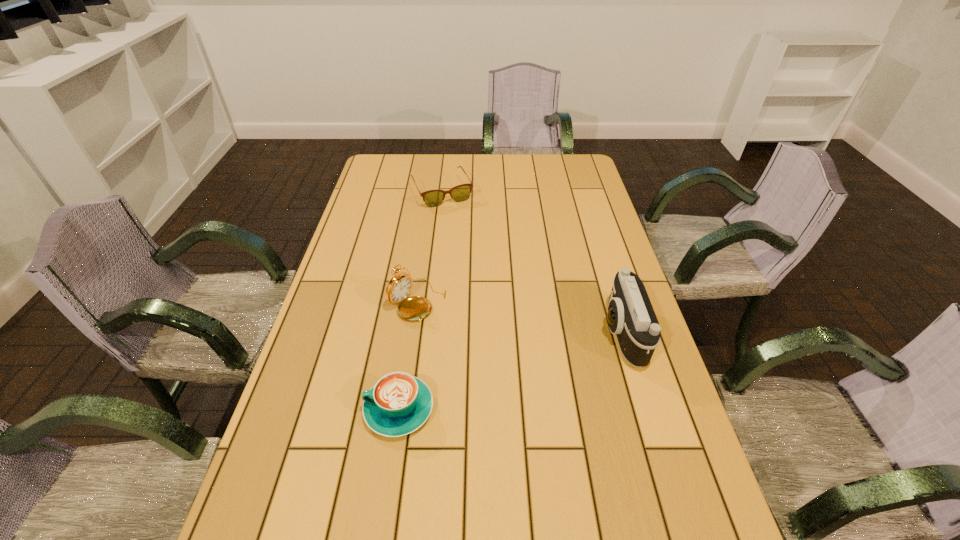
Where is `free region located 0.260m on the face of the pocket watch`? This screenshot has width=960, height=540. free region located 0.260m on the face of the pocket watch is located at coordinates (517, 359).

Where is `blank area located 0.300m on the face of the pocket watch`? blank area located 0.300m on the face of the pocket watch is located at coordinates (532, 366).

You are a GUI agent. You are given a task and a screenshot of the screen. Output one action in this format:
    pyautogui.click(x=<x>, y=<y>)
    Task: Click on the vacant space located on the face of the pocket watch
    This screenshot has height=540, width=960.
    Given the screenshot: What is the action you would take?
    pyautogui.click(x=498, y=347)

Where is `vacant region located at the front view of the farthest object`? vacant region located at the front view of the farthest object is located at coordinates (483, 265).

This screenshot has height=540, width=960. I want to click on blank space located at the front view of the farthest object, so tap(468, 239).

In order to click on vacant space located at the front view of the farthest object in this screenshot , I will do `click(479, 259)`.

The height and width of the screenshot is (540, 960). Find the location of `object that is at the far edge`. object that is at the far edge is located at coordinates (432, 198).

Identify the location of object at the right edge. (630, 316).

In the image, there is a desktop. At what (x,y) coordinates should I click in order to perform the action: click on vacant area at the far edge. Please return your answer as a coordinate pair (x, y). The width and height of the screenshot is (960, 540). Looking at the image, I should click on 455,159.

Find the location of a particular element. This screenshot has width=960, height=540. free space at the left edge of the desktop is located at coordinates (349, 238).